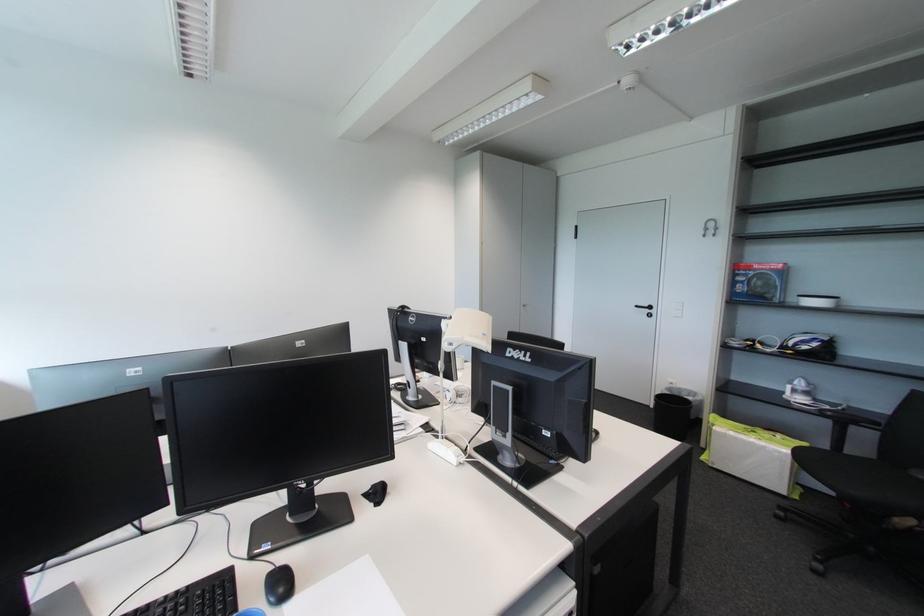
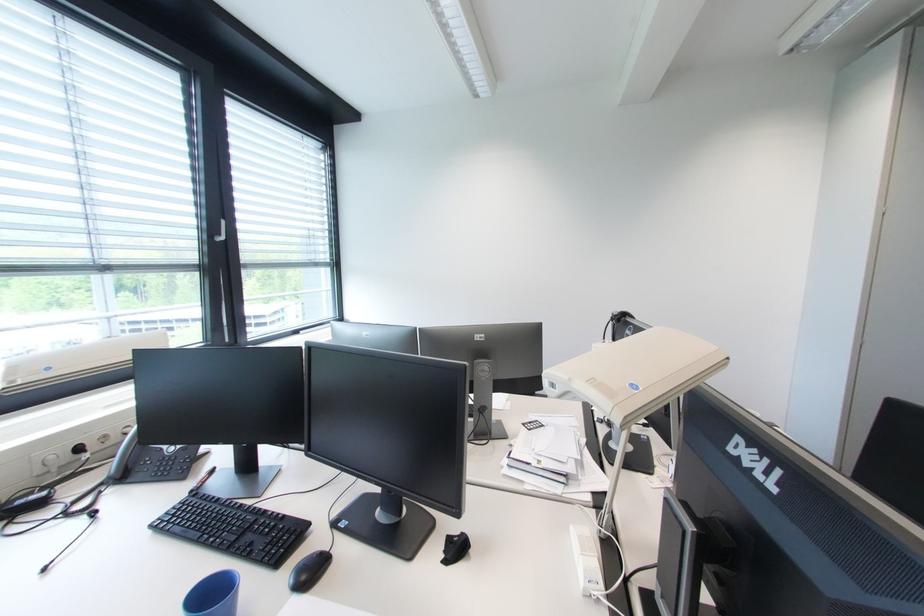
Where in the second image is the point corresponding to point (195, 589) from the first image?

(290, 517)